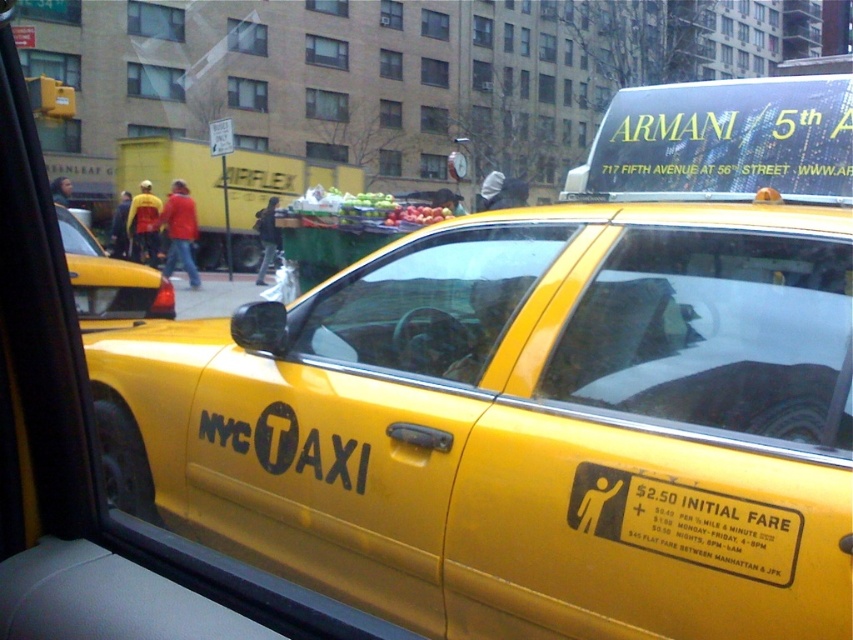
Which is in front, point (426, 384) or point (91, 240)?

Positioned in front is point (426, 384).

Can you confirm if yellow matte taxi at center is wider than yellow matte taxi at left?

Yes.

Who is more distant from viewer, (x=345, y=536) or (x=132, y=298)?

The point (x=132, y=298) is behind.

The image size is (853, 640). Find the location of `yellow matte taxi at center`. yellow matte taxi at center is located at coordinates (523, 426).